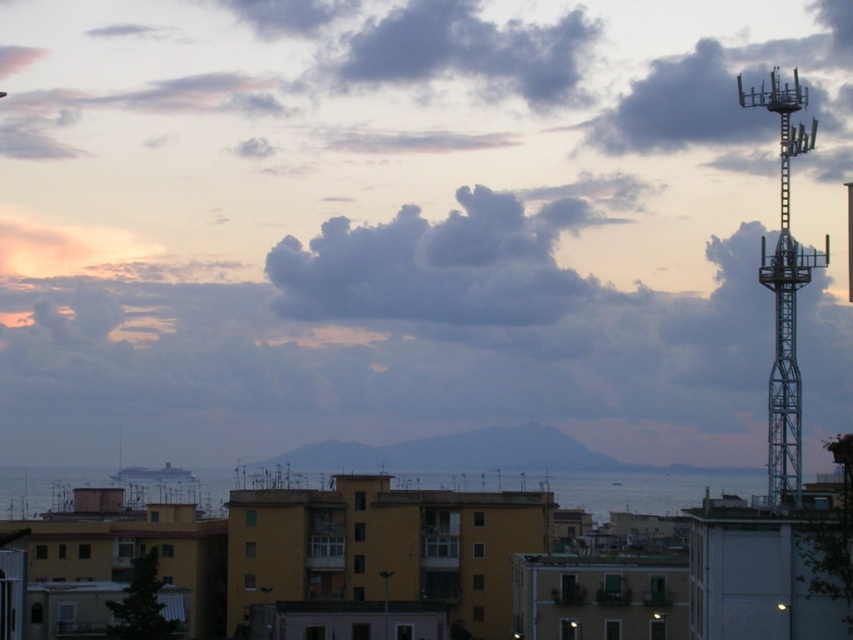
From the picture: You are an architect designing a new building that needs to align with the existing skyline. The city council requires that the new building must not block the view of the blue metallic cruise ship at lower center from any point along the riverfront. Given the current arrangement, would placing a new structure similar in height to the matte metal tower at upper right be acceptable?

The matte metal tower at upper right is above the blue metallic cruise ship at lower center, meaning it already blocks part of the view. Adding another tower of the same height could further obstruct the view of the cruise ship, so it might not be acceptable unless positioned carefully to avoid blocking the sightline.

You are an architect designing a new city skyline and need to ensure that the buildings align with specific proportions. Given the scene, which object between the matte metal tower at upper right and the white glossy cruise ship at center has a greater width, and how does this affect their placement in the design?

The matte metal tower at upper right has a greater width than the white glossy cruise ship at center. This means it should be placed in areas where horizontal space is more abundant to accommodate its broader structure, while the cruise ship can be positioned in narrower spaces due to its slimmer profile.

From the picture: You are a photographer trying to capture the white glossy cruise ship at center and the matte metal tower at upper right in the same frame. However, you notice that the cruise ship is partially obscured by the tower. Can you adjust your position to ensure both objects are fully visible without any overlap?

The white glossy cruise ship at center is behind the matte metal tower at upper right, so moving your position to the left or right might allow you to see around the tower and capture both objects without overlap.